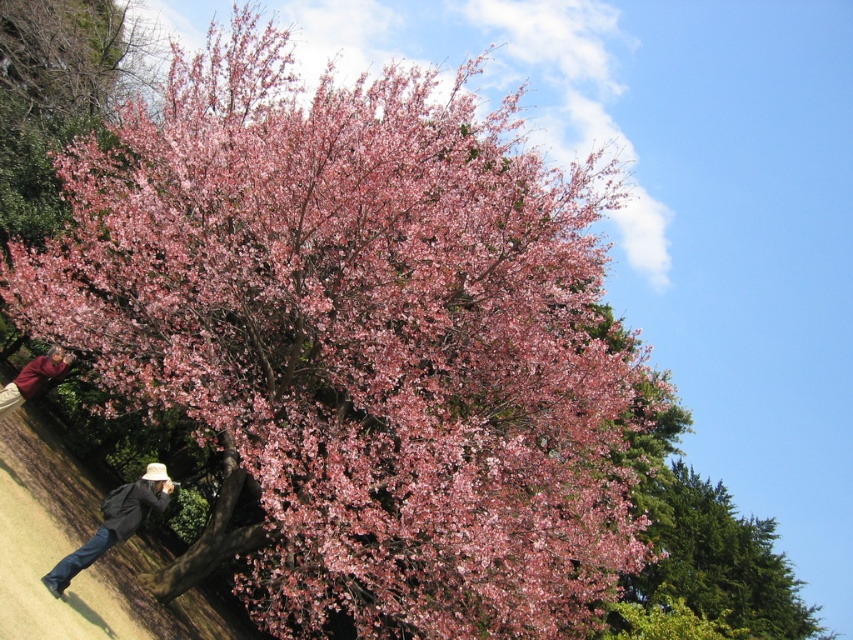
Can you confirm if denim jacket at lower left is smaller than matte brown jacket at lower left?

Incorrect, denim jacket at lower left is not smaller in size than matte brown jacket at lower left.

Which is in front, point (161, 476) or point (45, 356)?

Positioned in front is point (161, 476).

Where is `denim jacket at lower left`? The width and height of the screenshot is (853, 640). denim jacket at lower left is located at coordinates (114, 525).